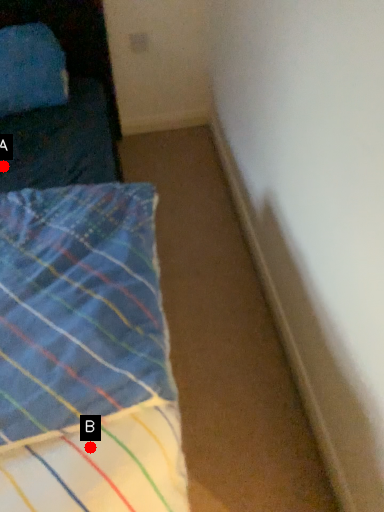
Question: Two points are circled on the image, labeled by A and B beside each circle. Which point is closer to the camera taking this photo?

Choices:
 (A) A is closer
 (B) B is closer

Answer: (B)